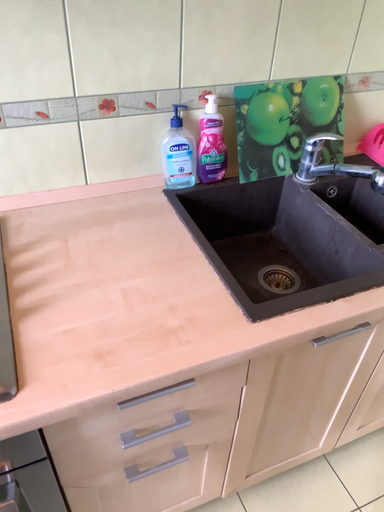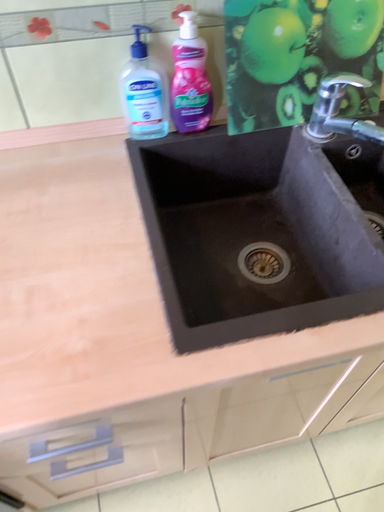
Question: Which way did the camera rotate in the video?

Choices:
 (A) rotated upward
 (B) rotated downward

Answer: (B)